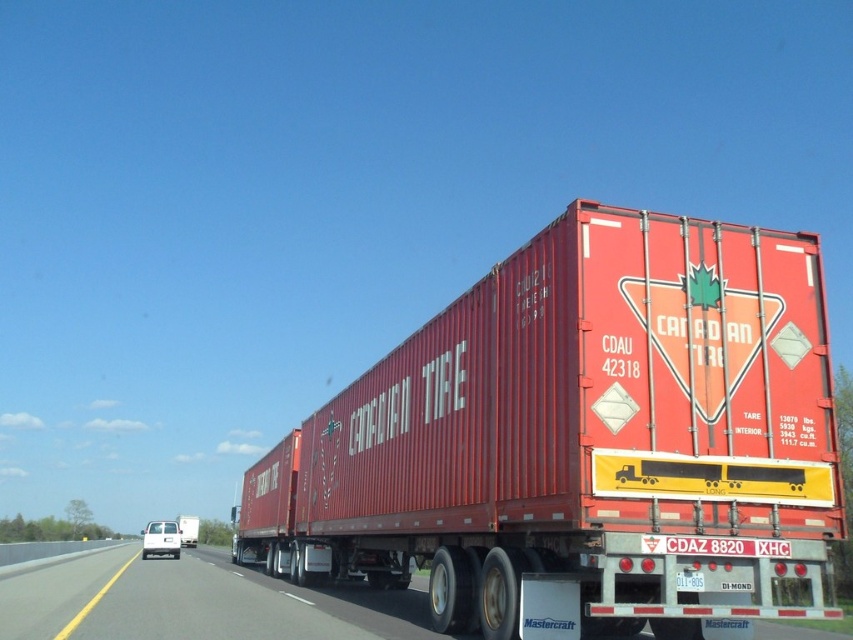
You are standing at point A located at coordinates point A at (x=599, y=538). You want to walk to point B, which is 6.95 meters away from point A. Can you reach point B within 10 seconds if you walk at a constant speed of 1.2 meters per second?

Since the distance between point A at (x=599, y=538) and point B is 6.95 meters, and your walking speed is 1.2 mps, the time required is 6.95 divided by 1.2, which equals approximately 5.79 seconds. Therefore, you can reach point B within 10 seconds.

Based on the photo, you are a photographer standing on the side of the highway. You want to take a photo of the Canadian Tire semi truck. You notice two points on the truck, one at point (224,627) and another at point (183,516). Which point will appear larger in your photo?

Point (224,627) will appear larger in the photo because it is closer to the camera than point (183,516).